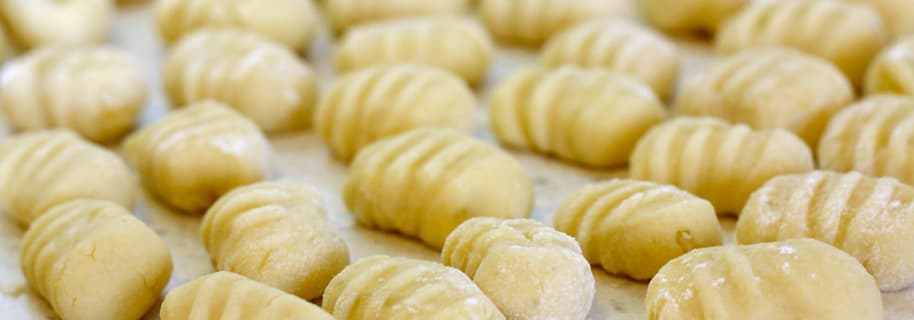
Identify the location of left side of baking sheet. (188, 249).